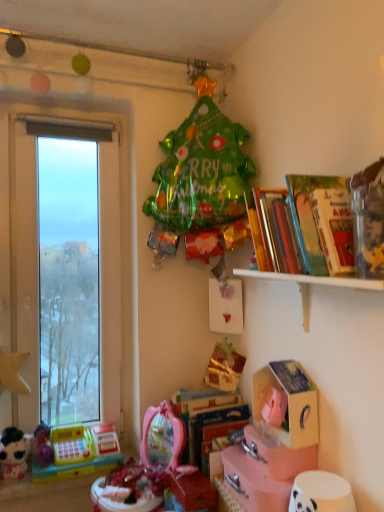
Question: Is point (266, 438) positioned closer to the camera than point (107, 501)?

Choices:
 (A) farther
 (B) closer

Answer: (B)

Question: Is pink cardboard box at lower center, the second cardboard box from the top, bigger or smaller than shiny pink toy at center, positioned as the third toy in left-to-right order?

Choices:
 (A) small
 (B) big

Answer: (B)

Question: Based on their relative distances, which object is nearer to the pink cardboard box at lower center, the second cardboard box from the top?

Choices:
 (A) hardcover book at upper right, arranged as the second book when viewed from the back
 (B) shiny pink mirror at lower center, the 4th toy viewed from the left
 (C) shiny pink toy at center, which appears as the 2th toy when viewed from the right
 (D) yellow plastic cash register at lower left, the 3th toy viewed from the right
 (E) hardcover book at center, placed as the first book when sorted from bottom to top

Answer: (E)

Question: Which of these objects is positioned closest to the white wooden shelf at upper right?

Choices:
 (A) shiny pink mirror at lower center, which ranks as the first toy in right-to-left order
 (B) matte pink cardboard box at lower center, which appears as the first cardboard box when viewed from the top
 (C) hardcover book at upper right, arranged as the second book when viewed from the back
 (D) plush white cat at lower left, acting as the 4th toy starting from the right
 (E) hardcover book at center, the 2th book in the front-to-back sequence

Answer: (C)